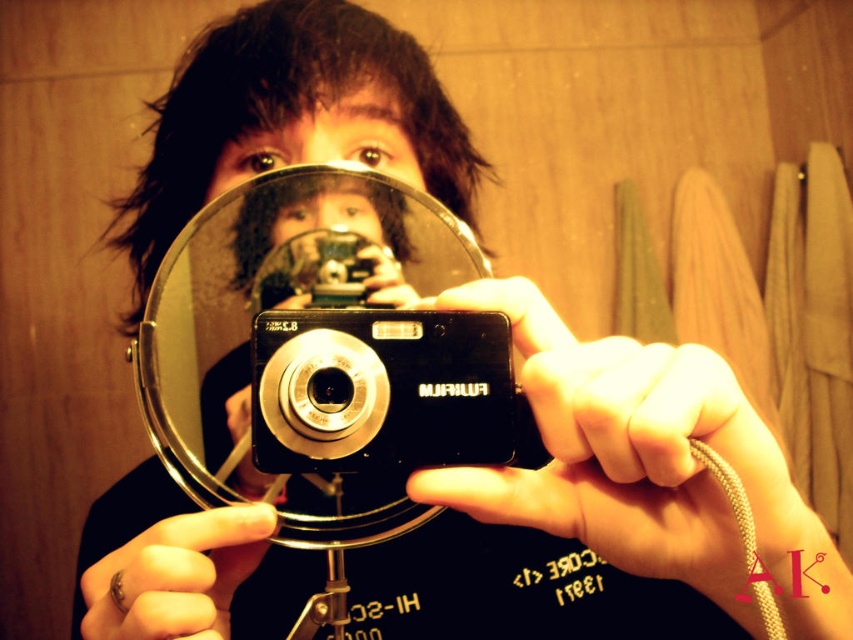
Question: Observing the image, what is the correct spatial positioning of clear glass mirror at center in reference to black plastic camera at center?

Choices:
 (A) right
 (B) left

Answer: (B)

Question: Does clear glass mirror at center have a lesser width compared to black plastic camera at center?

Choices:
 (A) yes
 (B) no

Answer: (B)

Question: Is clear glass mirror at center positioned before black plastic camera at center?

Choices:
 (A) yes
 (B) no

Answer: (A)

Question: Which object appears farthest from the camera in this image?

Choices:
 (A) clear glass mirror at center
 (B) black plastic camera at center

Answer: (B)